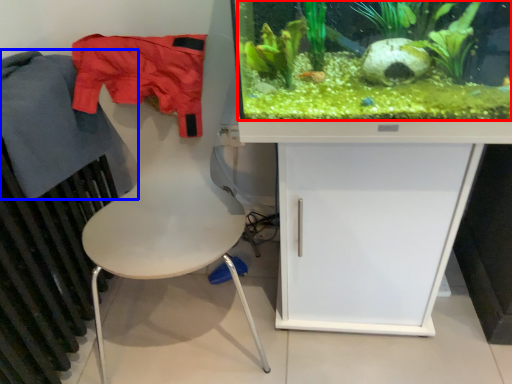
Question: Which object appears farthest to the camera in this image, plant (highlighted by a red box) or clothing (highlighted by a blue box)?

Choices:
 (A) plant
 (B) clothing

Answer: (B)